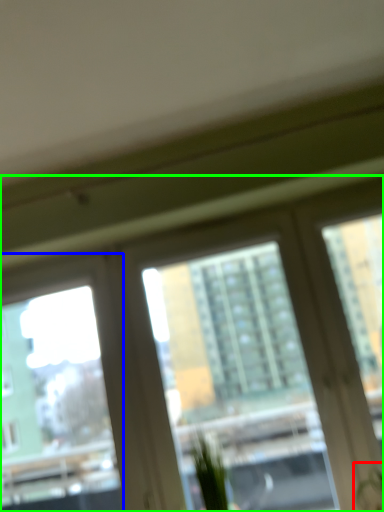
Question: Based on their relative distances, which object is nearer to plant (highlighted by a red box)? Choose from window screen (highlighted by a blue box) and window (highlighted by a green box).

Choices:
 (A) window screen
 (B) window

Answer: (B)